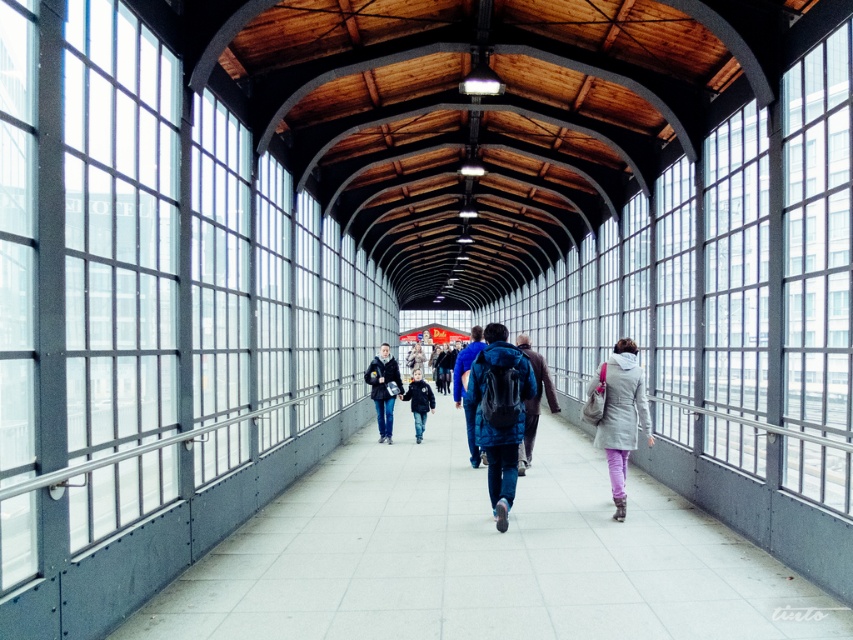
You are a delivery person carrying a package that requires a backpack larger than the one you currently have. You see a blue matte backpack at center and a dark blue backpack at center. Which backpack should you choose?

The blue matte backpack at center is bigger than the dark blue backpack at center, so you should choose the blue matte backpack at center.